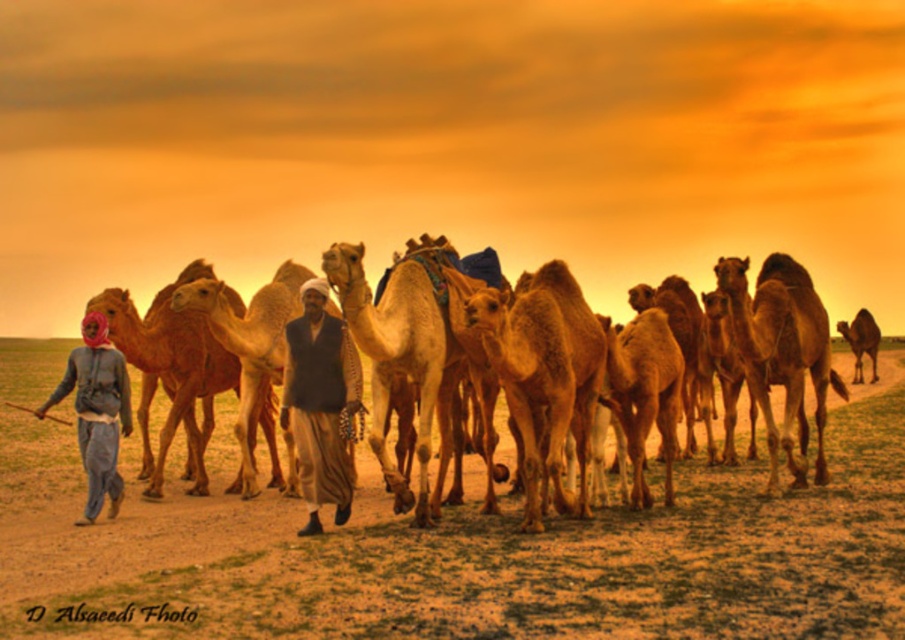
Question: Is dark brown woolen vest at center wider than brown textured camel at right?

Choices:
 (A) yes
 (B) no

Answer: (B)

Question: Is fuzzy beige camel at center positioned before denim jacket at left?

Choices:
 (A) yes
 (B) no

Answer: (B)

Question: Which of the following is the closest to the observer?

Choices:
 (A) dark brown woolen vest at center
 (B) brown textured sand at center
 (C) fuzzy beige camel at center

Answer: (B)

Question: Among these points, which one is farthest from the camera?

Choices:
 (A) (132, 342)
 (B) (78, 433)

Answer: (A)

Question: Which point is farther to the camera?

Choices:
 (A) dark brown woolen vest at center
 (B) brown textured camel at right
 (C) denim jacket at left
 (D) brown textured sand at center

Answer: (B)

Question: Is brown textured sand at center below fuzzy beige camel at center?

Choices:
 (A) no
 (B) yes

Answer: (B)